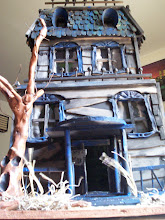
Find the location of a particular element. The image size is (165, 220). window is located at coordinates (44, 117), (130, 113), (59, 58), (104, 56).